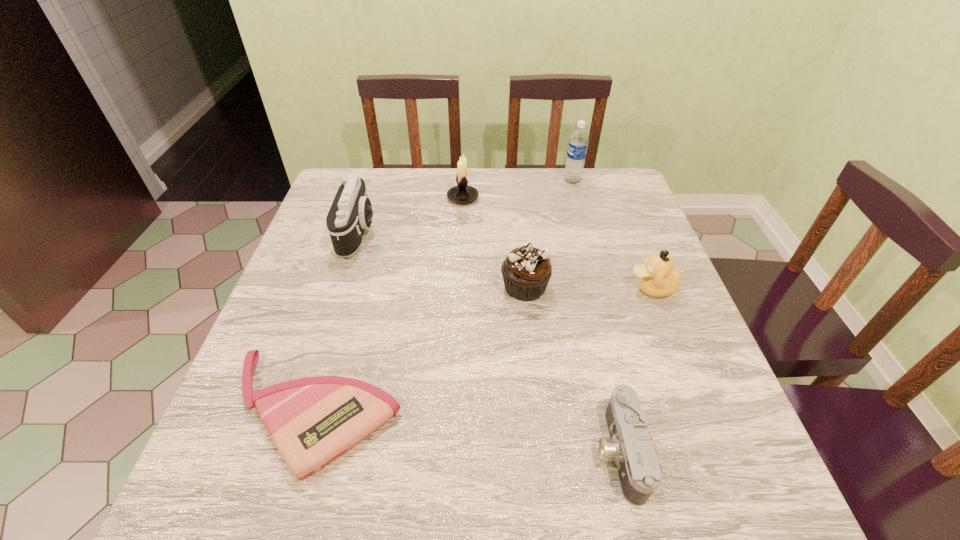
Find the location of `vacant space located on the left of the farthest object`. vacant space located on the left of the farthest object is located at coordinates (521, 180).

Locate an element on the screen. Image resolution: width=960 pixels, height=540 pixels. vacant area situated on the right of the fifth object from right to left is located at coordinates (506, 198).

Identify the location of vacant space situated 0.280m on the front lens of the taller camera. This screenshot has height=540, width=960. (483, 233).

The image size is (960, 540). Identify the location of vacant region located 0.390m on the front of the fourth object from left to right. (545, 487).

The image size is (960, 540). In order to click on vacant space located on the face of the rightmost object in this screenshot , I will do pyautogui.click(x=476, y=288).

Where is `free space located on the face of the rightmost object`? Image resolution: width=960 pixels, height=540 pixels. free space located on the face of the rightmost object is located at coordinates (528, 288).

Locate an element on the screen. The image size is (960, 540). vacant area situated 0.090m on the face of the rightmost object is located at coordinates (588, 288).

This screenshot has height=540, width=960. I want to click on vacant region located 0.070m on the lens of the shorter camera, so click(x=555, y=452).

Where is `vacant region located on the lens of the shorter camera`? vacant region located on the lens of the shorter camera is located at coordinates (407, 452).

Locate an element on the screen. Image resolution: width=960 pixels, height=540 pixels. blank space located on the lens of the shorter camera is located at coordinates pyautogui.click(x=407, y=452).